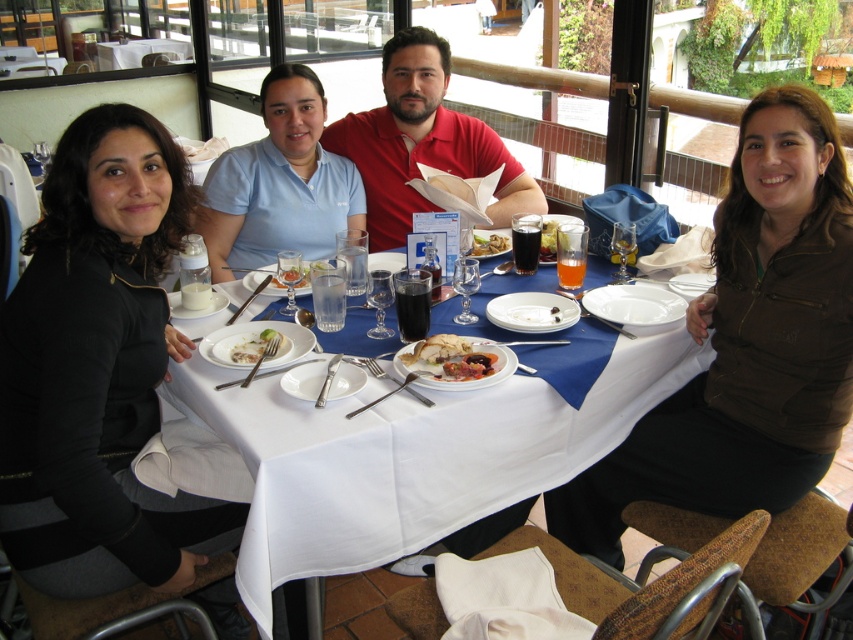
Is brown matte jacket at center wider than light blue polo shirt at center?

Yes.

Locate an element on the screen. The height and width of the screenshot is (640, 853). brown matte jacket at center is located at coordinates (747, 344).

Identify the location of brown matte jacket at center. (747, 344).

At what (x,y) coordinates should I click in order to perform the action: click on white cloth table at center. Please return your answer as a coordinate pair (x, y). Looking at the image, I should click on (409, 456).

Is white cloth table at center wider than golden brown bread at center?

Correct, the width of white cloth table at center exceeds that of golden brown bread at center.

Is point (639, 356) positioned in front of point (438, 378)?

No, (639, 356) is further to viewer.

In order to click on white cloth table at center in this screenshot , I will do `click(409, 456)`.

Does white cloth table at center appear under white glossy table at center?

Yes, white cloth table at center is below white glossy table at center.

Is white cloth table at center wider than white glossy table at center?

Indeed, white cloth table at center has a greater width compared to white glossy table at center.

What do you see at coordinates (409, 456) in the screenshot? I see `white cloth table at center` at bounding box center [409, 456].

The height and width of the screenshot is (640, 853). In order to click on white cloth table at center in this screenshot , I will do `click(409, 456)`.